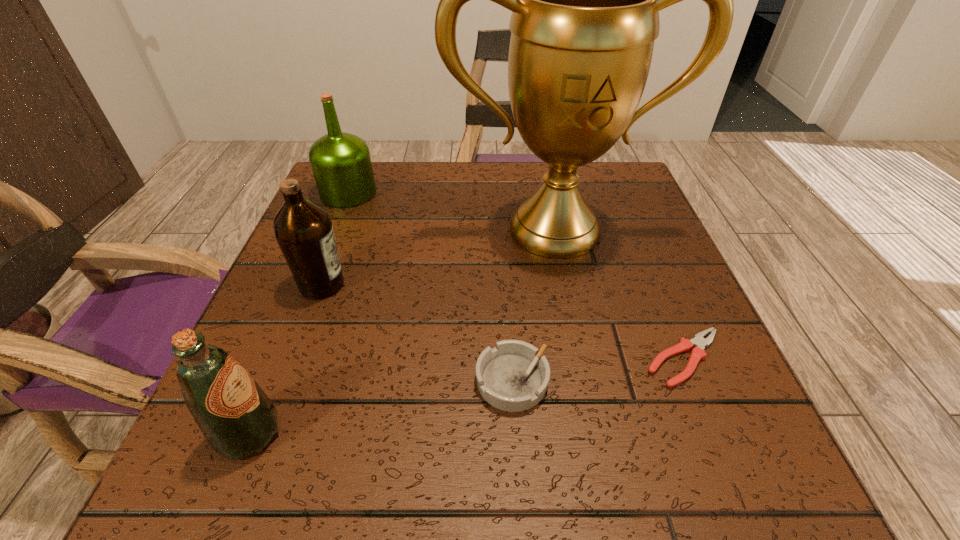
Image resolution: width=960 pixels, height=540 pixels. I want to click on the tallest object, so click(585, 0).

Where is `the farthest olive oil`? the farthest olive oil is located at coordinates (341, 164).

You are a GUI agent. You are given a task and a screenshot of the screen. Output one action in this format:
    pyautogui.click(x=<x>, y=<y>)
    Task: Click on the second nearest olive oil
    The height and width of the screenshot is (540, 960).
    Given the screenshot: What is the action you would take?
    pyautogui.click(x=303, y=230)

What are the coordinates of `the nearest olive oil` in the screenshot? It's located at (236, 417).

At what (x,y) coordinates should I click in order to perform the action: click on the fifth tallest object. Please return your answer as a coordinate pair (x, y). The height and width of the screenshot is (540, 960). Looking at the image, I should click on (513, 377).

I want to click on the shortest object, so click(698, 353).

Identify the location of vacant space located 0.060m on the surface of the trophy cup with symbols. (566, 287).

The image size is (960, 540). Find the location of `free spot located 0.080m on the front of the farthest olive oil`. free spot located 0.080m on the front of the farthest olive oil is located at coordinates (333, 230).

At what (x,y) coordinates should I click in order to perform the action: click on vacant region located on the label of the second nearest olive oil. Please return your answer as a coordinate pair (x, y). This screenshot has height=540, width=960. Looking at the image, I should click on (422, 285).

At what (x,y) coordinates should I click in order to perform the action: click on vacant space positioned on the front-facing side of the nearest olive oil. Please return your answer as a coordinate pair (x, y). The image size is (960, 540). Looking at the image, I should click on 550,433.